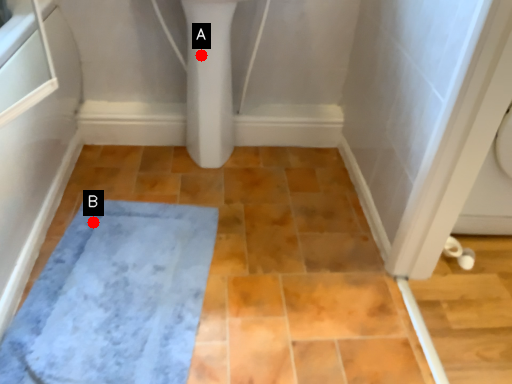
Question: Two points are circled on the image, labeled by A and B beside each circle. Which point is closer to the camera?

Choices:
 (A) A is closer
 (B) B is closer

Answer: (B)